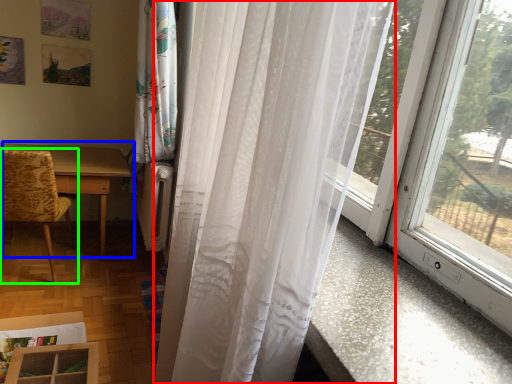
Question: Which object is positioned farthest from curtain (highlighted by a red box)? Select from table (highlighted by a blue box) and chair (highlighted by a green box).

Choices:
 (A) table
 (B) chair

Answer: (A)